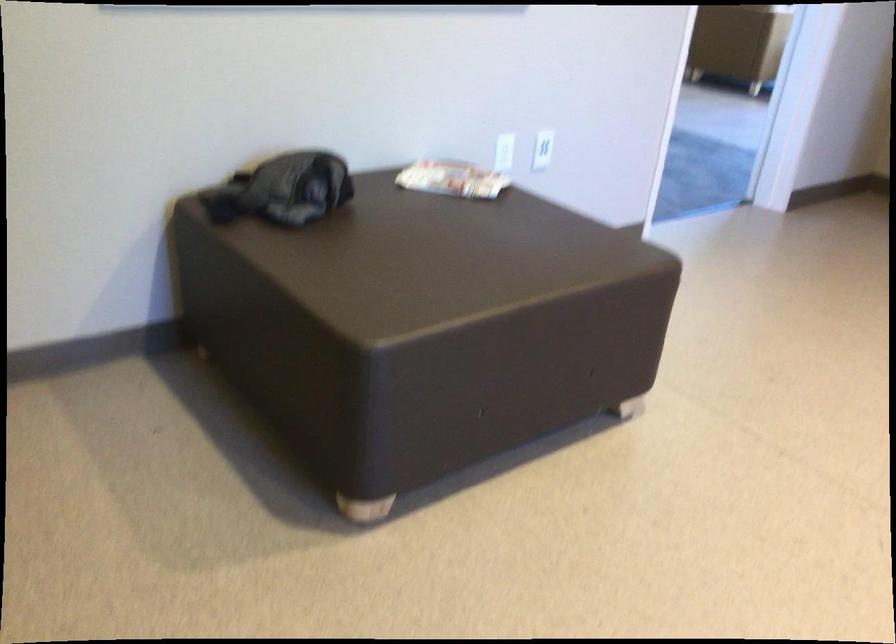
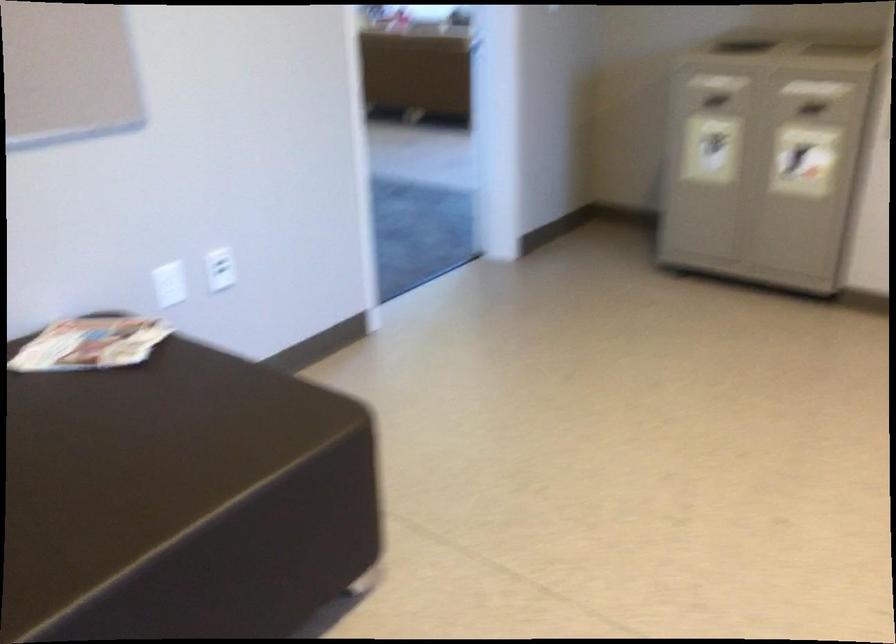
Question: How did the camera likely rotate?

Choices:
 (A) Left
 (B) Right
 (C) Up
 (D) Down

Answer: (B)